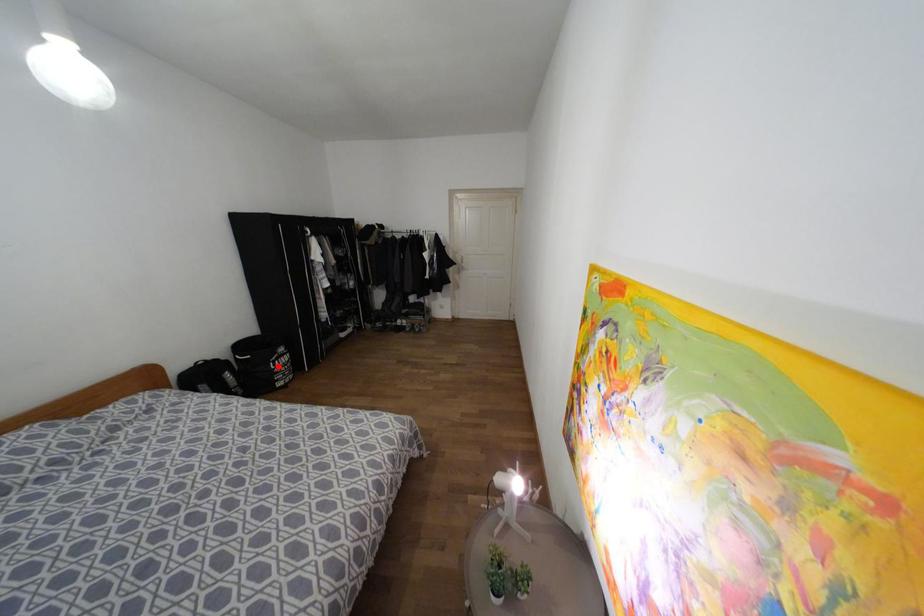
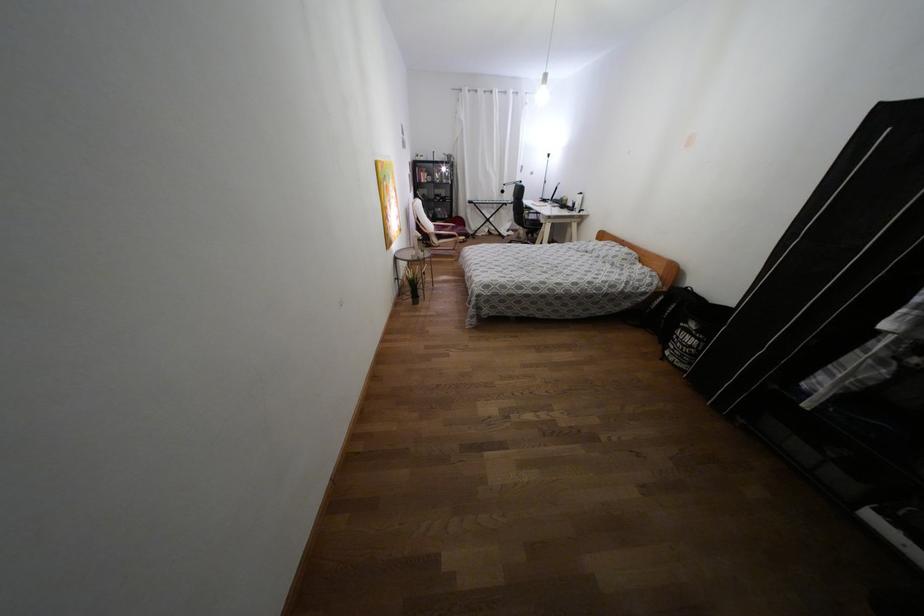
Where in the second image is the point corresponding to the highlighted location from the first image?

(676, 337)